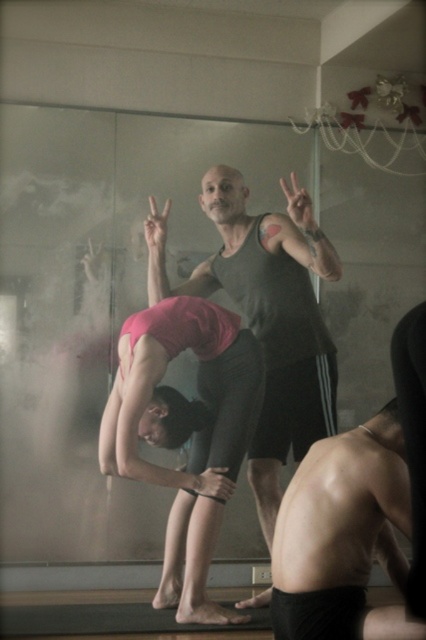
You are a photographer setting up for a dance photoshoot. You need to position a backdrop that is 2 meters wide. Considering the width of the matte black tank top at center and pink matte yoga pants at center, which one would require a wider backdrop to accommodate their pose?

The matte black tank top at center requires a wider backdrop because its width surpasses that of the pink matte yoga pants at center.

In the dance studio scene, where exactly is the matte black tank top at center located in terms of coordinates?

The matte black tank top at center is located at coordinates point (267, 316).